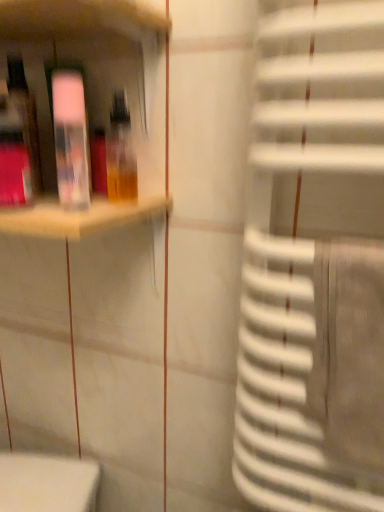
Question: Are transparent plastic bottle at upper left, placed as the 1th bottle when sorted from left to right, and matte plastic shelf at upper left located far from each other?

Choices:
 (A) yes
 (B) no

Answer: (B)

Question: Is transparent plastic bottle at upper left, placed as the 1th bottle when sorted from left to right, facing away from matte plastic shelf at upper left?

Choices:
 (A) yes
 (B) no

Answer: (A)

Question: Considering the relative positions of transparent plastic bottle at upper left, placed as the 1th bottle when sorted from left to right, and matte plastic shelf at upper left in the image provided, is transparent plastic bottle at upper left, placed as the 1th bottle when sorted from left to right, to the right of matte plastic shelf at upper left from the viewer's perspective?

Choices:
 (A) yes
 (B) no

Answer: (A)

Question: Does transparent plastic bottle at upper left, the 2th bottle in the right-to-left sequence, have a greater width compared to matte plastic shelf at upper left?

Choices:
 (A) yes
 (B) no

Answer: (B)

Question: From the image's perspective, is transparent plastic bottle at upper left, the 2th bottle in the right-to-left sequence, over matte plastic shelf at upper left?

Choices:
 (A) yes
 (B) no

Answer: (B)

Question: Does transparent plastic bottle at upper left, placed as the 1th bottle when sorted from left to right, have a lesser width compared to matte plastic shelf at upper left?

Choices:
 (A) yes
 (B) no

Answer: (A)

Question: Does translucent plastic bottle at upper left, placed as the second bottle when sorted from left to right, have a greater height compared to matte plastic shelf at upper left?

Choices:
 (A) no
 (B) yes

Answer: (A)

Question: Does translucent plastic bottle at upper left, the first bottle viewed from the right, have a lesser height compared to matte plastic shelf at upper left?

Choices:
 (A) yes
 (B) no

Answer: (A)

Question: From a real-world perspective, is translucent plastic bottle at upper left, the first bottle viewed from the right, on top of matte plastic shelf at upper left?

Choices:
 (A) yes
 (B) no

Answer: (A)

Question: Does translucent plastic bottle at upper left, placed as the second bottle when sorted from left to right, have a larger size compared to matte plastic shelf at upper left?

Choices:
 (A) no
 (B) yes

Answer: (A)

Question: Is translucent plastic bottle at upper left, placed as the second bottle when sorted from left to right, positioned beyond the bounds of matte plastic shelf at upper left?

Choices:
 (A) no
 (B) yes

Answer: (A)

Question: Does translucent plastic bottle at upper left, the first bottle viewed from the right, come behind matte plastic shelf at upper left?

Choices:
 (A) yes
 (B) no

Answer: (A)

Question: Is matte plastic shelf at upper left taller than translucent plastic bottle at upper left, the first bottle viewed from the right?

Choices:
 (A) no
 (B) yes

Answer: (B)